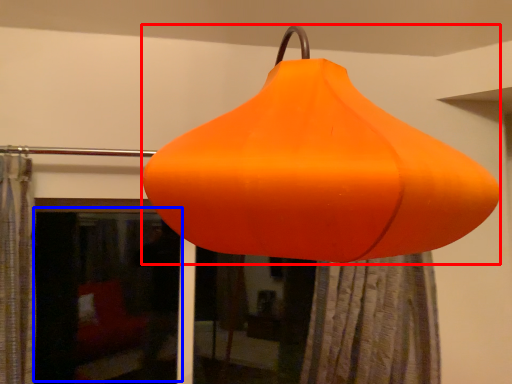
Question: Among these objects, which one is nearest to the camera, lantern (highlighted by a red box) or window screen (highlighted by a blue box)?

Choices:
 (A) lantern
 (B) window screen

Answer: (A)